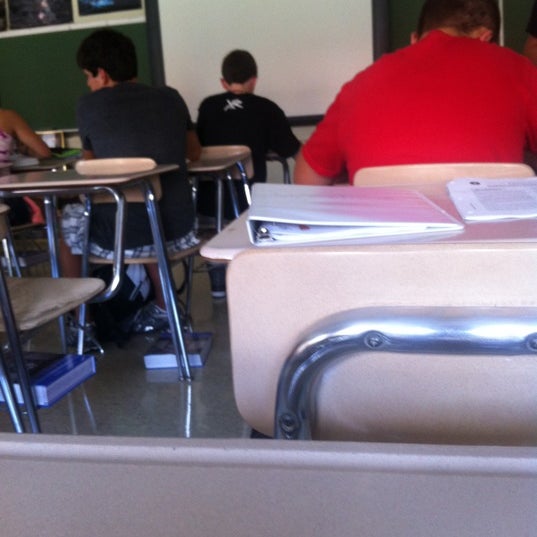
Find the location of `stack of papers`. stack of papers is located at coordinates (498, 194).